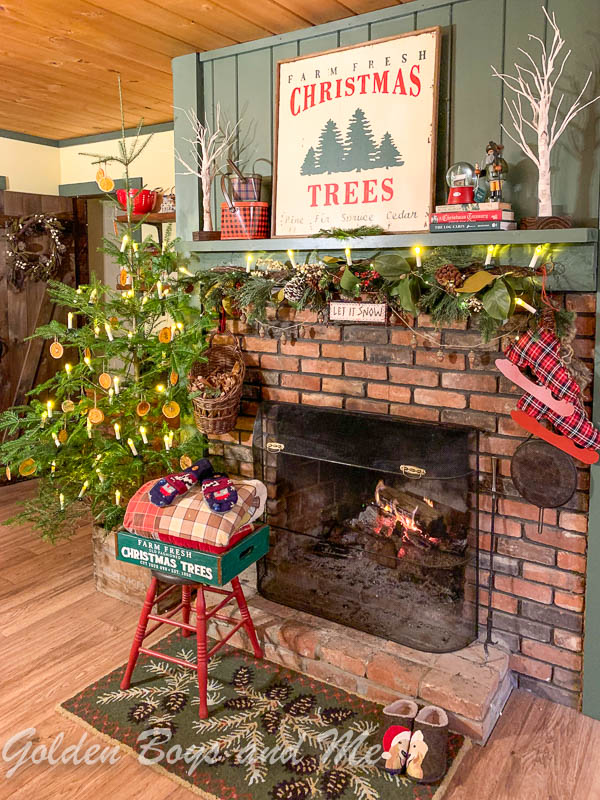
Identify the location of christmas mat. The image size is (600, 800). (226, 784).